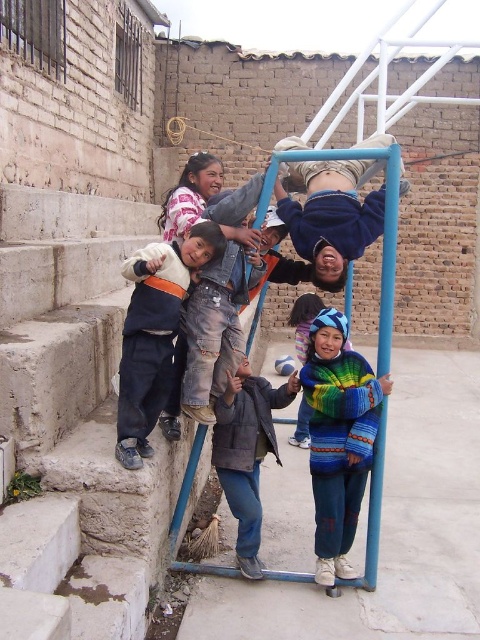
Question: Which object is farther from the camera taking this photo?

Choices:
 (A) denim jacket at left
 (B) multicolored knitted sweater at center
 (C) blue fleece jacket at center
 (D) dark gray jacket at center

Answer: (D)

Question: Estimate the real-world distances between objects in this image. Which object is closer to the rainbow knitted sweater at center?

Choices:
 (A) multicolored knitted sweater at center
 (B) dark gray jacket at center
 (C) blue fleece jacket at center
 (D) denim jacket at left

Answer: (B)

Question: Which point is farther from the camera taking this photo?

Choices:
 (A) (177, 305)
 (B) (337, 170)
 (C) (252, 448)
 (D) (304, 400)

Answer: (D)

Question: Does multicolored knitted sweater at center have a lesser width compared to blue fleece jacket at center?

Choices:
 (A) no
 (B) yes

Answer: (B)

Question: Is multicolored knitted sweater at center bigger than denim jacket at left?

Choices:
 (A) yes
 (B) no

Answer: (B)

Question: Is multicolored knitted sweater at center wider than blue fleece jacket at center?

Choices:
 (A) yes
 (B) no

Answer: (B)